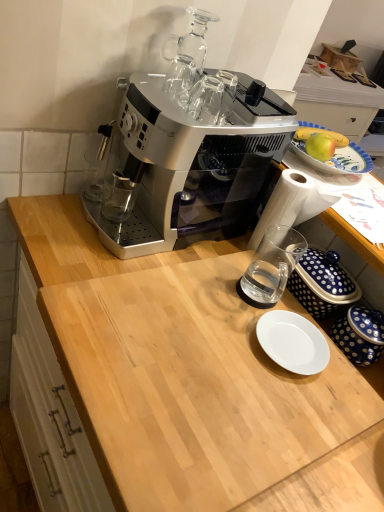
The width and height of the screenshot is (384, 512). What are the coordinates of `vacant space to the left of blue dotted ceramic jar at lower right` in the screenshot? It's located at (278, 325).